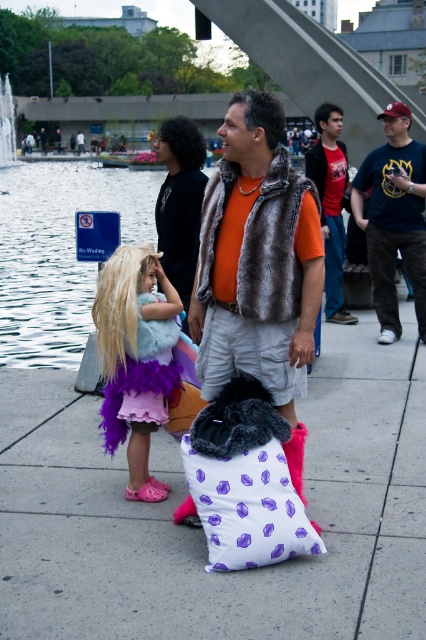
Question: Can you confirm if white dotted pillow at lower center is positioned to the left of purple feathered dress at left?

Choices:
 (A) no
 (B) yes

Answer: (A)

Question: Among these points, which one is farthest from the camera?

Choices:
 (A) (164, 218)
 (B) (368, 488)

Answer: (A)

Question: Where is white dotted pillow at lower center located in relation to dark brown fur vest at center in the image?

Choices:
 (A) above
 (B) below

Answer: (B)

Question: Which of the following is the farthest from the observer?

Choices:
 (A) brushed metal water at upper left
 (B) red t-shirt at center
 (C) purple feathered dress at left

Answer: (A)

Question: Among these points, which one is nearest to the camera?

Choices:
 (A) (14, 113)
 (B) (209, 564)

Answer: (B)

Question: Where is purple feather boa at center located in relation to dark brown fur vest at center in the image?

Choices:
 (A) below
 (B) above

Answer: (A)